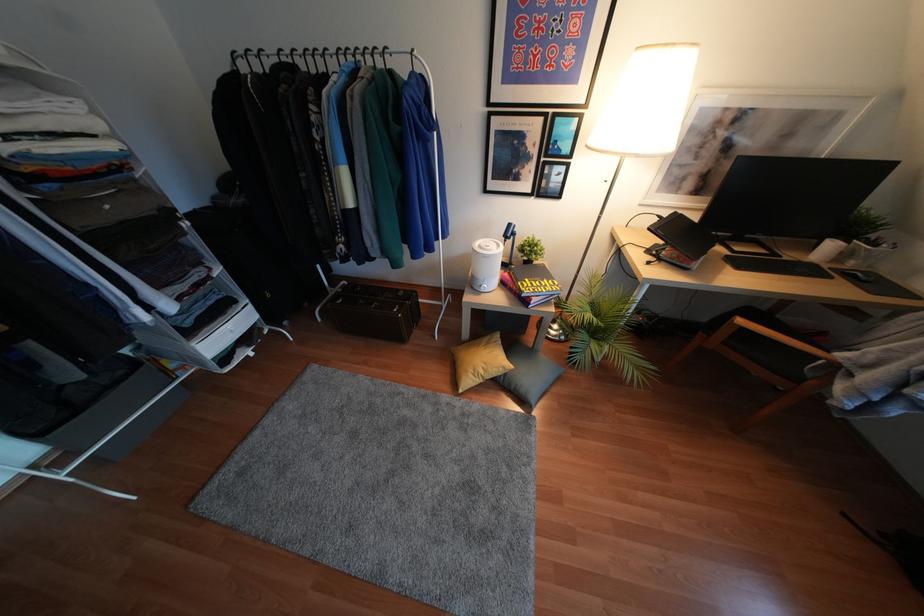
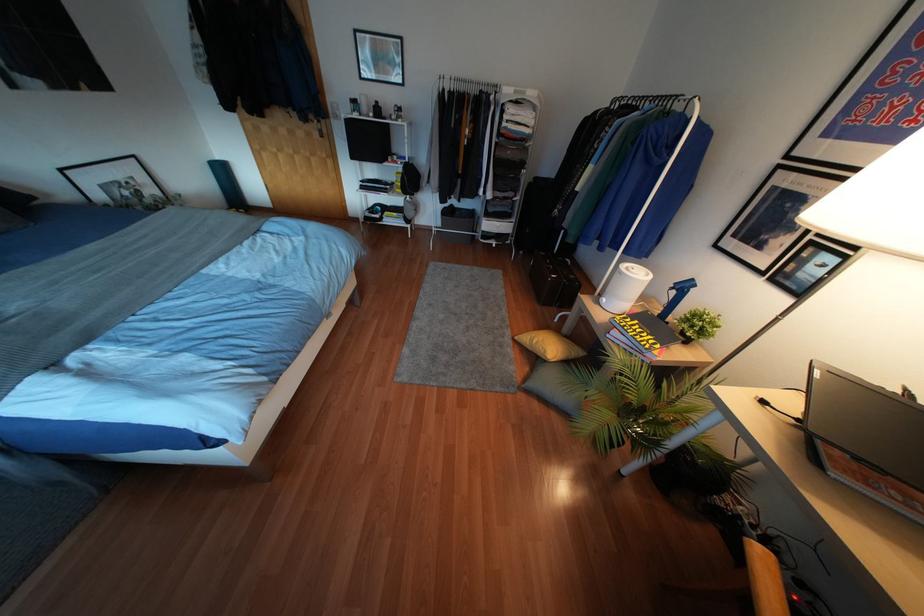
In the second image, find the point that corresponds to pixel 480 371 in the first image.

(533, 341)